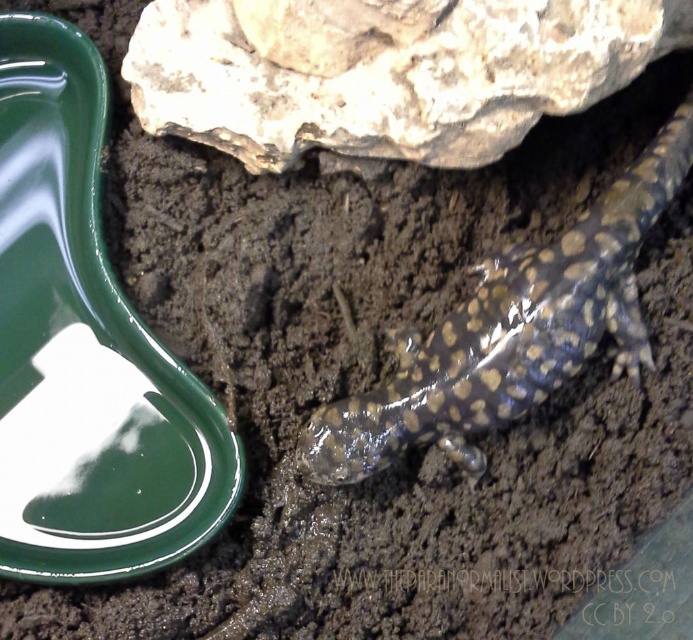
Between rough textured rock at upper center and shiny brown spotted lizard at lower right, which one is positioned higher?

rough textured rock at upper center is higher up.

Between rough textured rock at upper center and shiny brown spotted lizard at lower right, which one appears on the left side from the viewer's perspective?

rough textured rock at upper center

In the scene shown: Who is more forward, (148, 80) or (525, 376)?

Point (525, 376)

Where is `rough textured rock at upper center`? The width and height of the screenshot is (693, 640). rough textured rock at upper center is located at coordinates (385, 72).